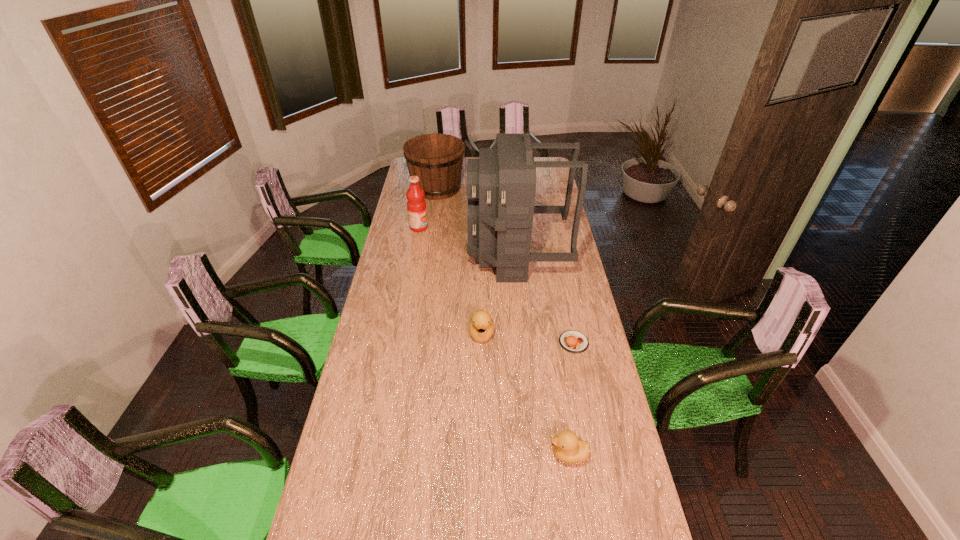
In the current image, all ducklings are evenly spaced. To maintain this equal spacing, where should an additional duckling be placed on the left? Please point out a free spot. Please provide its 2D coordinates. Your answer should be formatted as a tuple, i.e. [(x, y)], where the tuple contains the x and y coordinates of a point satisfying the conditions above.

[(425, 255)]